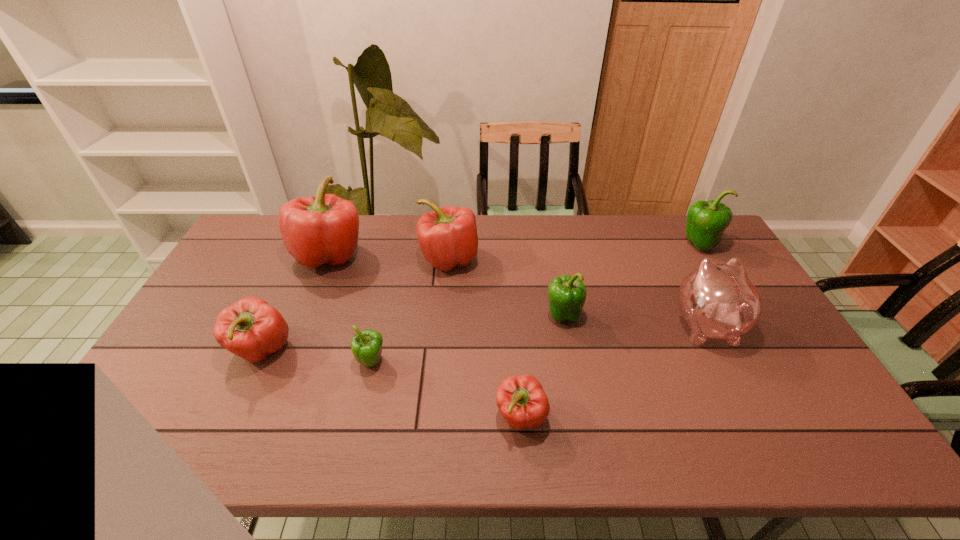
Where is `vacant space located 0.130m on the front of the second smallest pink bell pepper`? Image resolution: width=960 pixels, height=540 pixels. vacant space located 0.130m on the front of the second smallest pink bell pepper is located at coordinates (228, 424).

Find the location of `vacant region located 0.320m on the back of the fifth bell pepper from right to left`. vacant region located 0.320m on the back of the fifth bell pepper from right to left is located at coordinates (391, 273).

This screenshot has height=540, width=960. I want to click on vacant space located 0.280m on the right of the smallest pink bell pepper, so click(663, 417).

Where is `object located in the near edge section of the desktop`? object located in the near edge section of the desktop is located at coordinates (521, 400).

You are a GUI agent. You are given a task and a screenshot of the screen. Output one action in this format:
    pyautogui.click(x=<x>, y=<y>)
    Task: Click on the bell pepper that is at the right edge
    The width and height of the screenshot is (960, 540).
    Given the screenshot: What is the action you would take?
    pyautogui.click(x=706, y=221)

Where is `piggy bank present at the right edge`? piggy bank present at the right edge is located at coordinates (718, 301).

Where is `object located in the far right corner section of the desktop`? This screenshot has height=540, width=960. object located in the far right corner section of the desktop is located at coordinates (706, 221).

At what (x,y) coordinates should I click in order to perform the action: click on free space at the far edge of the desktop. Please return your answer as a coordinate pair (x, y). Image resolution: width=960 pixels, height=540 pixels. Looking at the image, I should click on (411, 232).

At what (x,y) coordinates should I click in order to perform the action: click on vacant space at the near edge of the desktop. Please return your answer as a coordinate pair (x, y). Image resolution: width=960 pixels, height=540 pixels. Looking at the image, I should click on (603, 455).

Identify the location of free space at the left edge of the desktop. tap(191, 319).